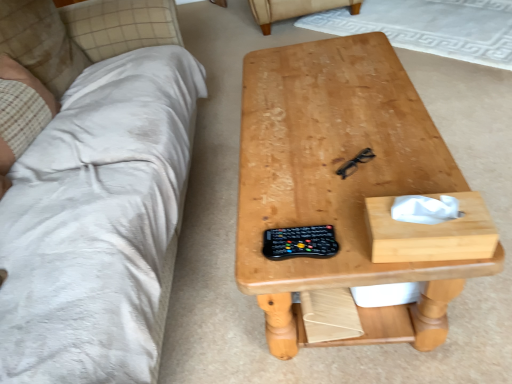
Where is `vacant space that is to the left of black plastic remote at center`? This screenshot has width=512, height=384. vacant space that is to the left of black plastic remote at center is located at coordinates (259, 261).